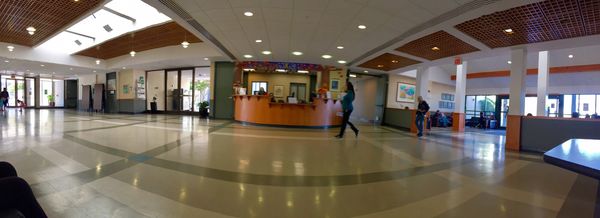
At what (x,y) coordinates should I click in order to perform the action: click on interior view. Please return your answer as a coordinate pair (x, y). This screenshot has height=218, width=600. Looking at the image, I should click on (290, 168).